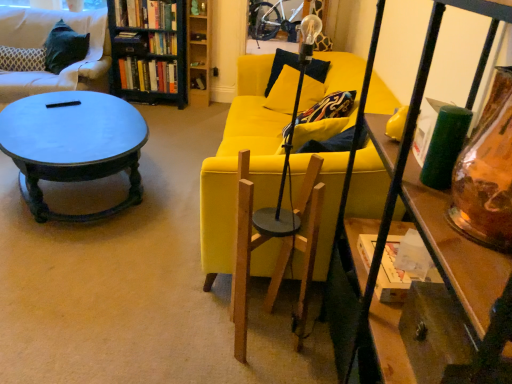
Where is `free space above matte dark blue coffee table at left (from a real-world perspective)`? This screenshot has height=384, width=512. free space above matte dark blue coffee table at left (from a real-world perspective) is located at coordinates (66, 112).